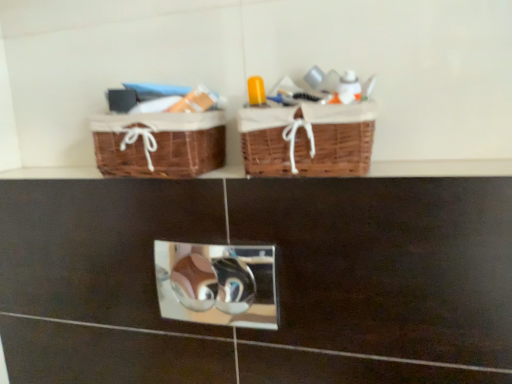
Question: Looking at their shapes, would you say metallic reflective mirror at center is wider or thinner than brown wicker baskets at upper center?

Choices:
 (A) thin
 (B) wide

Answer: (A)

Question: From the image's perspective, is metallic reflective mirror at center above or below brown wicker baskets at upper center?

Choices:
 (A) below
 (B) above

Answer: (A)

Question: Which of these objects is positioned farthest from the woven brown picnic basket at upper center, which is the 2th picnic basket from left to right?

Choices:
 (A) brown woven picnic basket at left, arranged as the first picnic basket when viewed from the left
 (B) brown wicker baskets at upper center
 (C) metallic reflective mirror at center

Answer: (C)

Question: Which object is positioned closest to the brown wicker baskets at upper center?

Choices:
 (A) brown woven picnic basket at left, arranged as the first picnic basket when viewed from the left
 (B) woven brown picnic basket at upper center, which is the 2th picnic basket from left to right
 (C) metallic reflective mirror at center

Answer: (B)